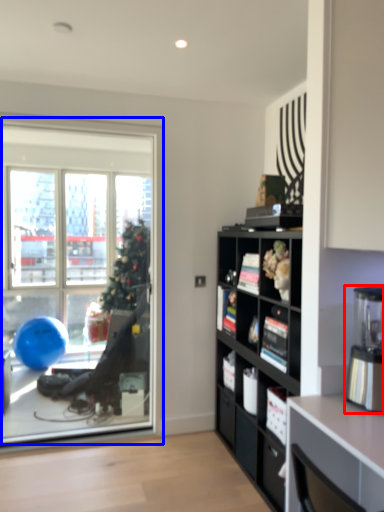
Question: Among these objects, which one is farthest to the camera, coffee machine (highlighted by a red box) or window (highlighted by a blue box)?

Choices:
 (A) coffee machine
 (B) window

Answer: (B)